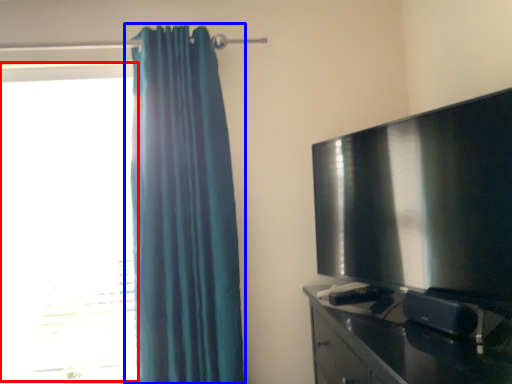
Question: Among these objects, which one is nearest to the camera, window (highlighted by a red box) or curtain (highlighted by a blue box)?

Choices:
 (A) window
 (B) curtain

Answer: (B)